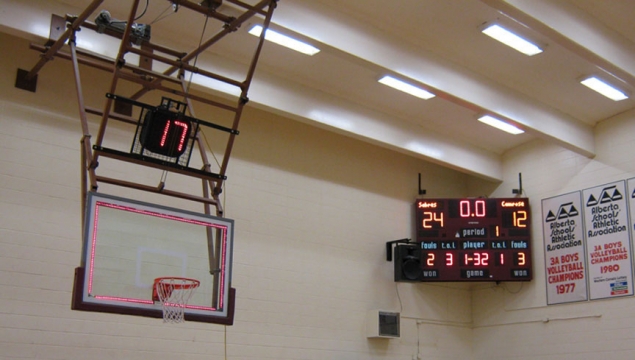
Locate an element on the screen. This screenshot has width=635, height=360. fluorescent lights is located at coordinates (281, 36), (392, 83), (503, 125), (595, 95), (512, 43).